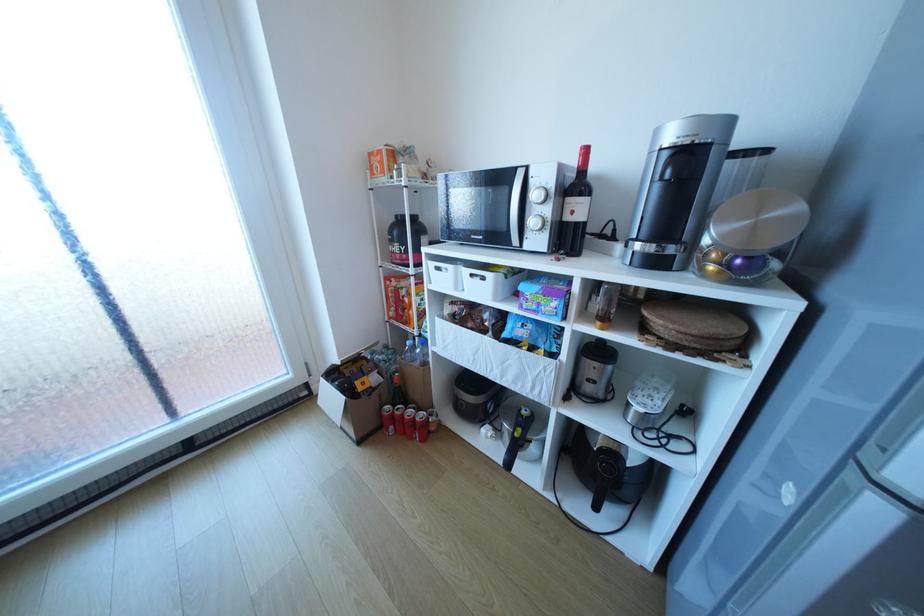
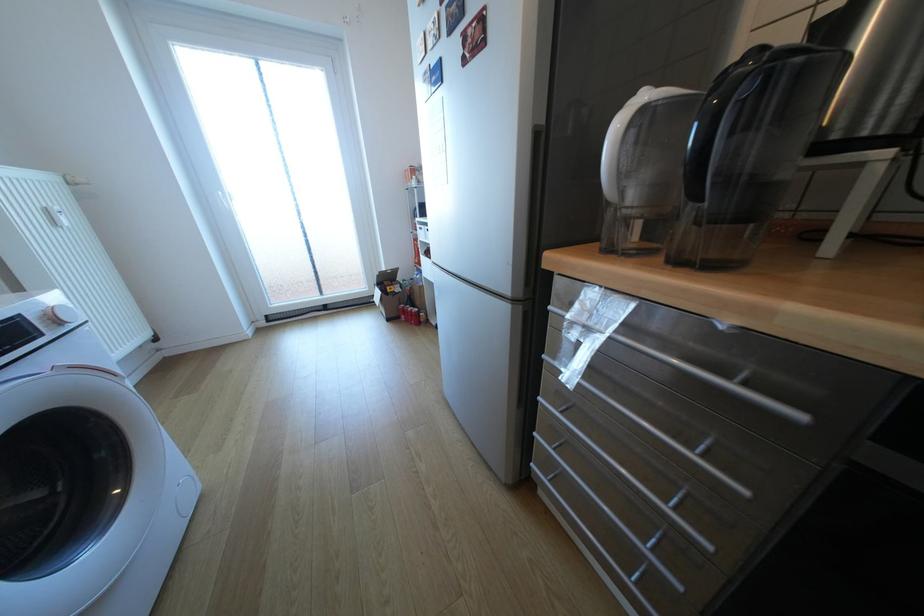
Which direction would the cameraman need to move to produce the second image?

The movement direction of the cameraman is right, backward.